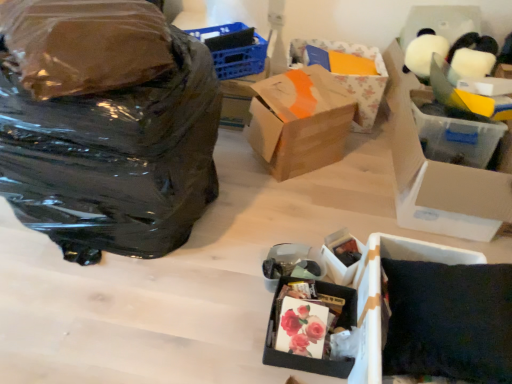
In order to click on free space in front of brown cardboard box at center, which ranks as the 2th box in top-to-bottom order in this screenshot , I will do `click(295, 203)`.